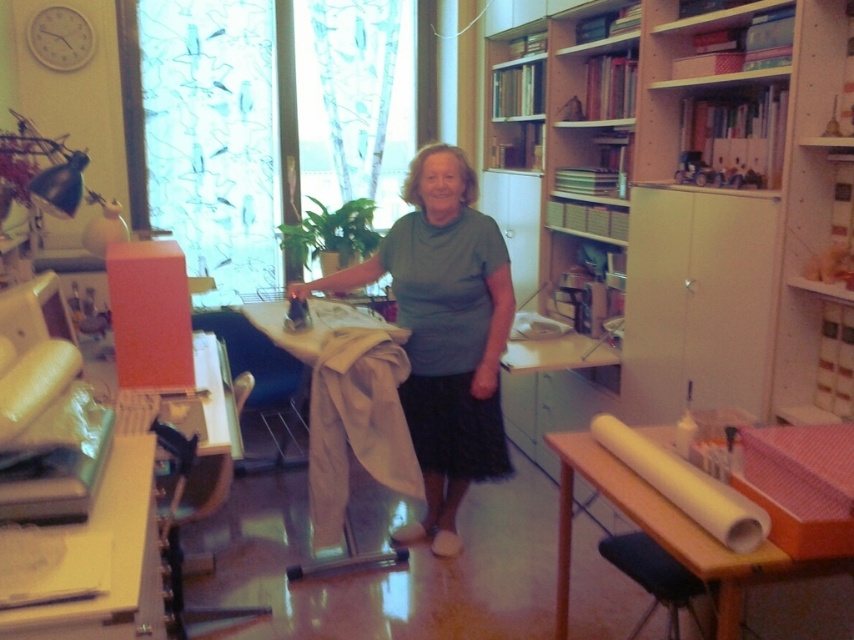
Is green cotton shirt at center in front of wooden table at lower left?

That is False.

Is point (486, 333) more distant than point (38, 612)?

That is True.

Locate an element on the screen. The height and width of the screenshot is (640, 854). green cotton shirt at center is located at coordinates (443, 333).

Can you confirm if smooth beige ironing board at center is bigger than wooden table at lower right?

Indeed, smooth beige ironing board at center has a larger size compared to wooden table at lower right.

Is point (389, 429) closer to viewer compared to point (644, 429)?

No, it is not.

Locate an element on the screen. smooth beige ironing board at center is located at coordinates (346, 404).

Is point (465, 484) more distant than point (651, 509)?

Yes, it is behind point (651, 509).

Is green cotton shirt at center thinner than wooden table at lower right?

In fact, green cotton shirt at center might be wider than wooden table at lower right.

The image size is (854, 640). I want to click on green cotton shirt at center, so click(443, 333).

The height and width of the screenshot is (640, 854). What are the coordinates of `green cotton shirt at center` in the screenshot? It's located at [x=443, y=333].